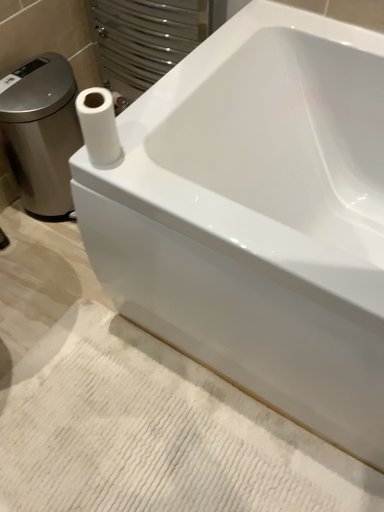
You are a GUI agent. You are given a task and a screenshot of the screen. Output one action in this format:
    pyautogui.click(x=<x>, y=<y>)
    Task: Click on the vacant space to the right of white matte paper towel at upper left
    The height and width of the screenshot is (512, 384).
    Given the screenshot: What is the action you would take?
    pyautogui.click(x=165, y=169)